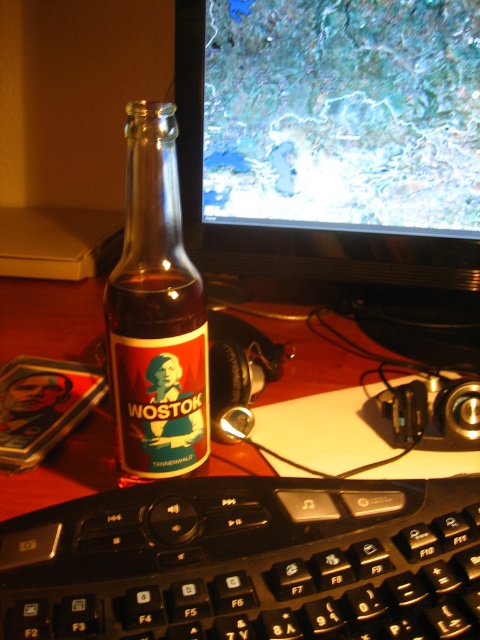
Question: Can you confirm if black plastic keyboard at lower center is positioned above translucent glass bottle at center?

Choices:
 (A) yes
 (B) no

Answer: (B)

Question: Does black plastic keyboard at lower center have a smaller size compared to translucent glass bottle at center?

Choices:
 (A) no
 (B) yes

Answer: (A)

Question: Is black plastic keyboard at lower center to the right of translucent glass bottle at center from the viewer's perspective?

Choices:
 (A) no
 (B) yes

Answer: (B)

Question: Among these points, which one is nearest to the camera?

Choices:
 (A) (296, 632)
 (B) (158, 337)

Answer: (A)